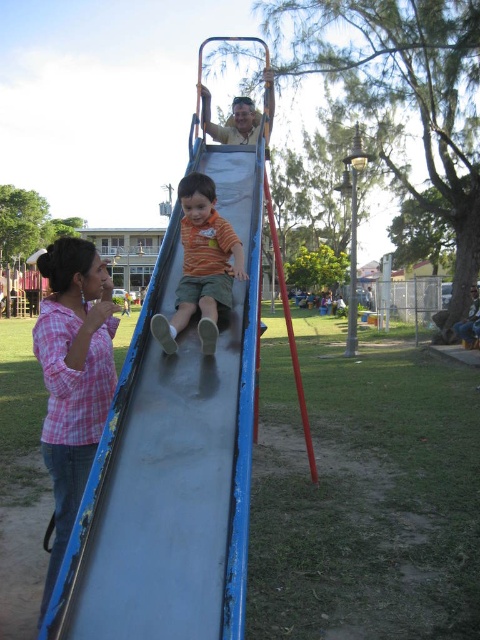
In the scene shown: You are planning to install a new bench next to the blue painted wood slide at center and the pink plaid shirt at left. Considering their widths, which object requires more space for the bench to fit comfortably?

The blue painted wood slide at center requires more space because its width surpasses that of the pink plaid shirt at left, so the bench should be placed accordingly to accommodate its larger size.

You are a parent at the playground and want to place a small toy between the smooth wooden slide at upper center and the blue jeans at lower right. According to the scene, where should you place the toy to ensure it is between these two objects?

The smooth wooden slide at upper center is positioned on the left side of blue jeans at lower right, so placing the toy between them would require positioning it to the right of the slide and to the left of the blue jeans at lower right.

You are standing at point [171,461] in the playground. What object is directly beneath you?

The blue painted wood slide at center is located at point [171,461], so the object directly beneath you is the blue painted wood slide at center.